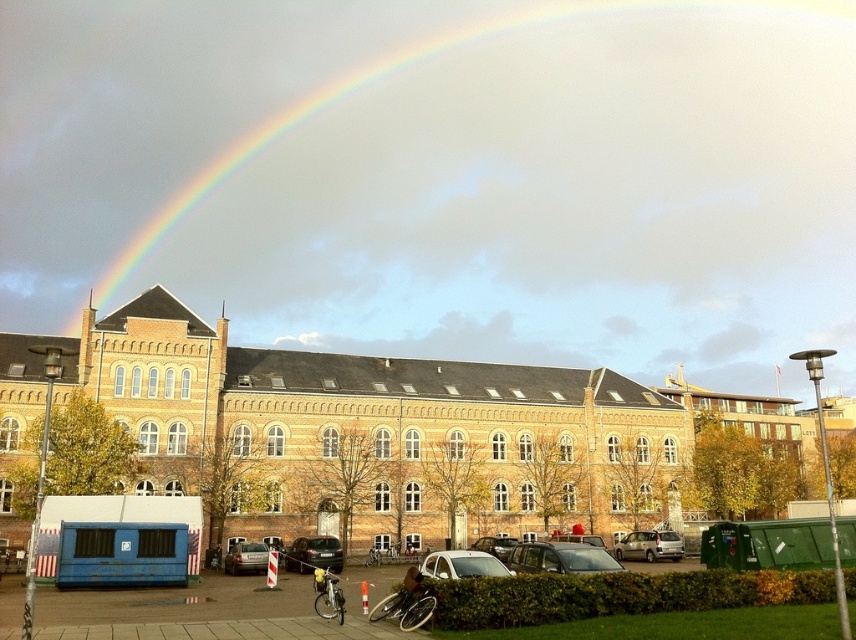
Is point (339, 92) positioned behind point (421, 563)?

Yes, it is behind point (421, 563).

Between point (357, 68) and point (474, 550), which one is positioned in front?

Positioned in front is point (474, 550).

The width and height of the screenshot is (856, 640). I want to click on rainbow at upper center, so [390, 74].

Can you confirm if matte silver car at center is positioned below matte black car at center?

No, matte silver car at center is not below matte black car at center.

From the picture: Can you confirm if matte silver car at center is positioned to the right of matte black car at center?

In fact, matte silver car at center is to the left of matte black car at center.

Does point (238, 557) come in front of point (480, 550)?

Yes, it is.

You are a GUI agent. You are given a task and a screenshot of the screen. Output one action in this format:
    pyautogui.click(x=<x>, y=<y>)
    Task: Click on the matte silver car at center
    Image resolution: width=856 pixels, height=640 pixels.
    Given the screenshot: What is the action you would take?
    pyautogui.click(x=247, y=557)

Who is taller, shiny silver car at center or matte black car at center?

shiny silver car at center is taller.

Does shiny silver car at center have a lesser height compared to matte black car at center?

No, shiny silver car at center is not shorter than matte black car at center.

The height and width of the screenshot is (640, 856). What are the coordinates of `shiny silver car at center` in the screenshot? It's located at (462, 564).